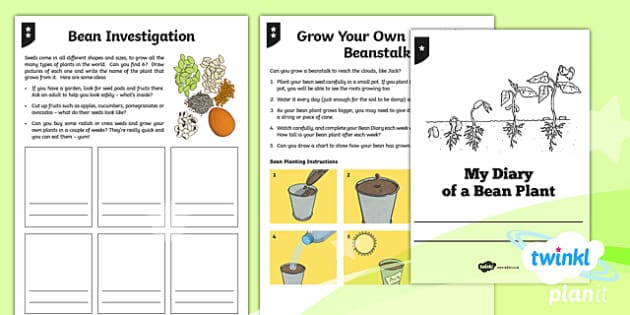
Where is `plant`? plant is located at coordinates (188, 71), (220, 70), (441, 129), (465, 128), (517, 116), (553, 101).